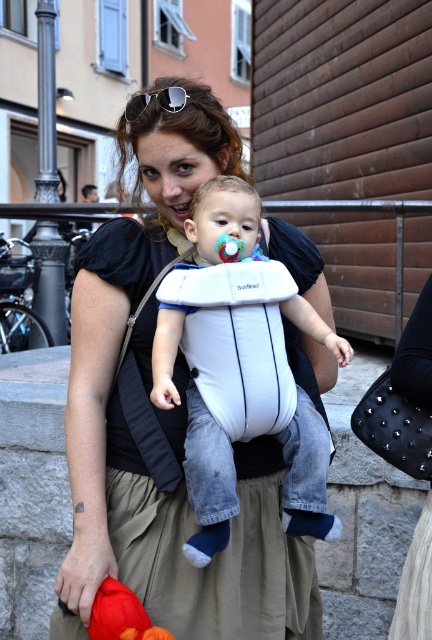
You are standing in front of the image and want to touch the two points mentioned. Which point, point (x=133, y=605) or point (x=186, y=93), is closer to you?

Point (x=133, y=605) is closer to the viewer than point (x=186, y=93).

You are standing in the scene and want to pick up the velvety orange toy at lower left. Based on its coordinates, is it closer to the bottom edge or the top edge of the image?

The velvety orange toy at lower left is located at point [120,614]. Since the y coordinate is 0.280, which is closer to 0.0 than 1.0, it is closer to the bottom edge of the image.

You are taking a photo of the scene and want to focus on both the woman holding the baby and the background stone wall. Which point, point (x=270, y=506) or point (x=229, y=260), is closer to the camera?

Point (x=229, y=260) is closer to the camera than point (x=270, y=506).